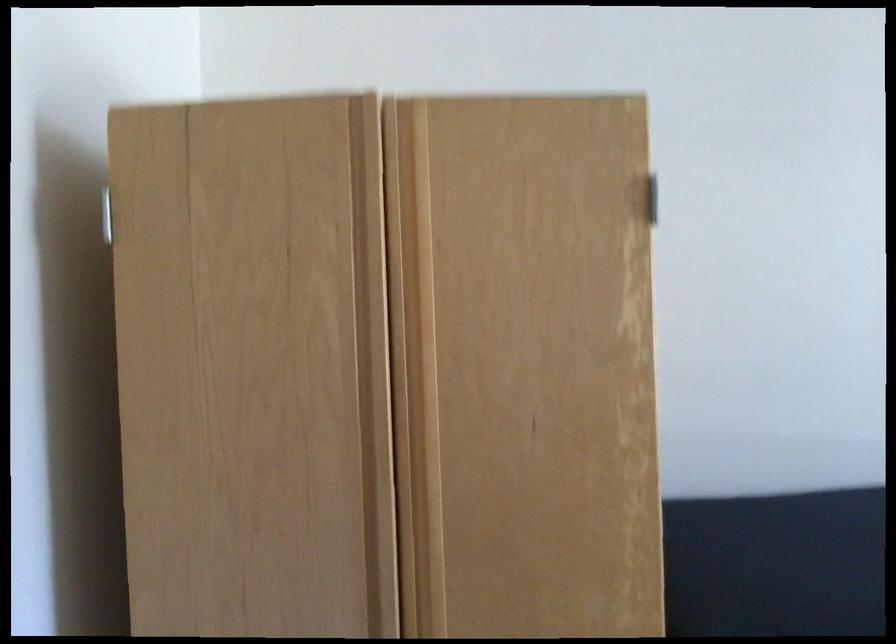
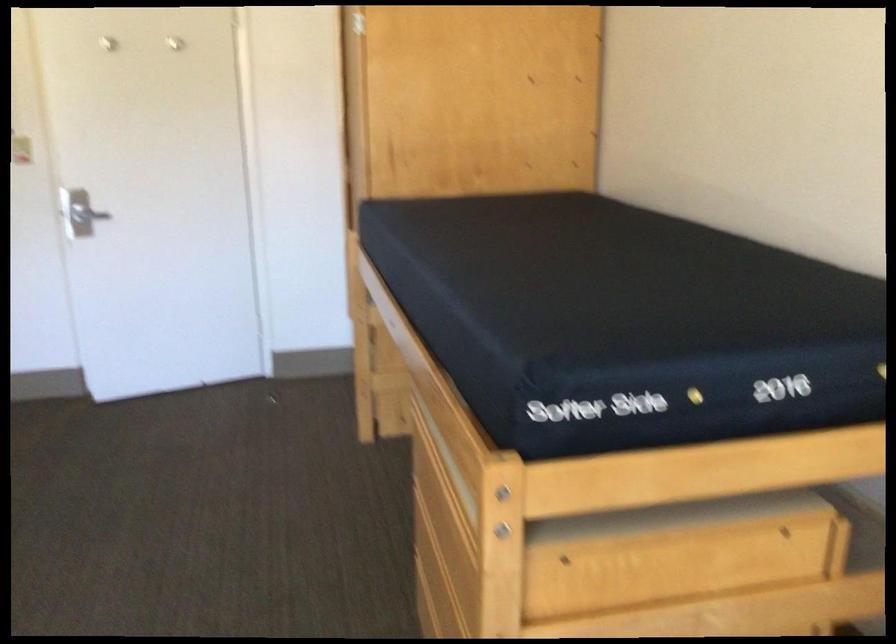
Question: I am providing you with two images of the same scene from different viewpoints. After the viewpoint changes to image2, which objects are now occluded?

Choices:
 (A) silver door handle
 (B) blender container
 (C) recessed door pull
 (D) light switch

Answer: (C)